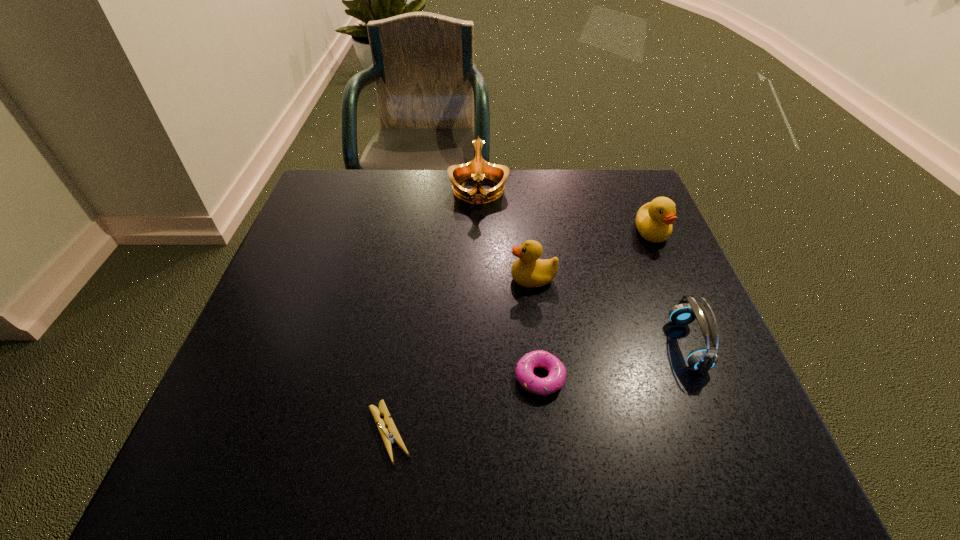
I want to click on tiara, so click(x=478, y=168).

Image resolution: width=960 pixels, height=540 pixels. What are the coordinates of `the right duck` in the screenshot? It's located at [x=654, y=220].

Locate an element on the screen. the fifth nearest object is located at coordinates (654, 220).

Find the location of a particular element. the left duck is located at coordinates (528, 270).

Find the location of a particular element. the nearer duck is located at coordinates (528, 270).

Find the location of a particular element. headset is located at coordinates (702, 359).

I want to click on doughnut, so [554, 381].

You are a GUI agent. You are given a task and a screenshot of the screen. Output one action in this format:
    pyautogui.click(x=<x>, y=<y>)
    Task: Click on the clothespin
    This screenshot has width=960, height=540.
    Given the screenshot: What is the action you would take?
    pyautogui.click(x=394, y=436)

What are the coordinates of `the shortest object` in the screenshot? It's located at (394, 436).

The width and height of the screenshot is (960, 540). In order to click on free spot located 0.280m at the front emblem of the tiara in this screenshot , I will do `click(478, 291)`.